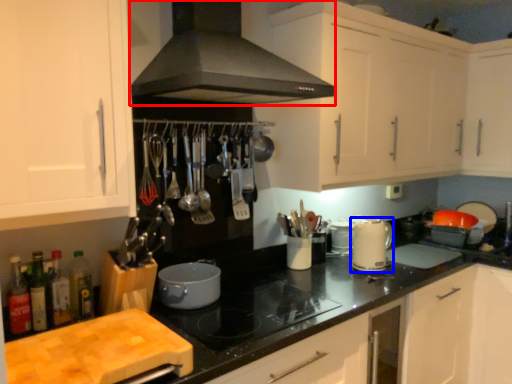
Question: Which object is further to the camera taking this photo, home appliance (highlighted by a red box) or kitchen appliance (highlighted by a blue box)?

Choices:
 (A) home appliance
 (B) kitchen appliance

Answer: (B)